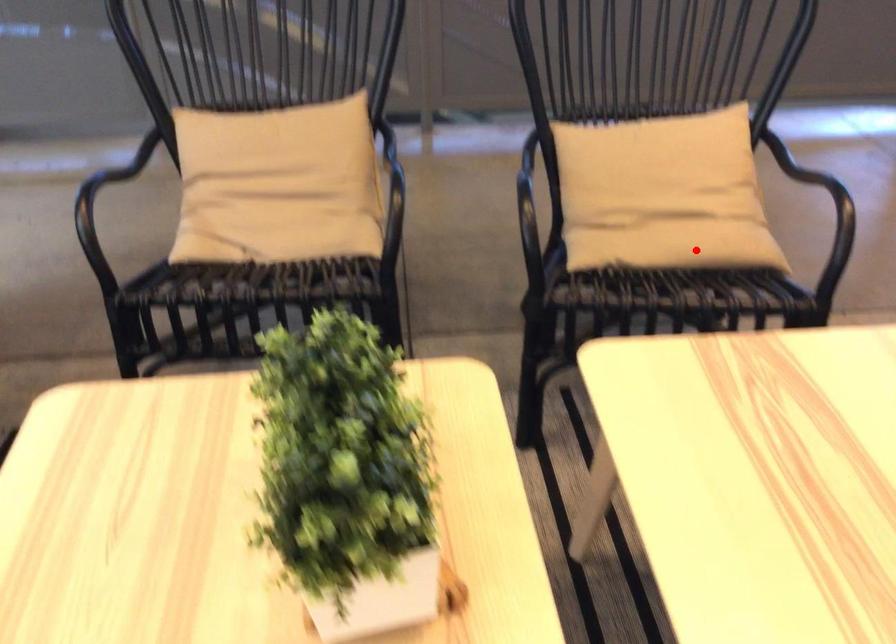
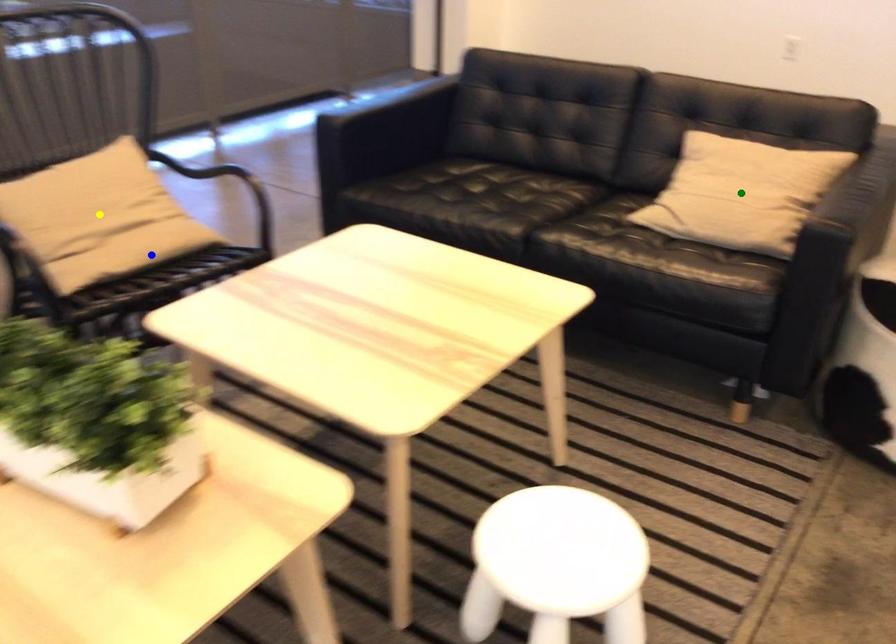
Question: I am providing you with two images of the same scene from different viewpoints. A red point is marked on the first image. You are given multiple points on the second image. Can you choose the point in image 2 that corresponds to the point in image 1?

Choices:
 (A) yellow point
 (B) blue point
 (C) green point

Answer: (B)